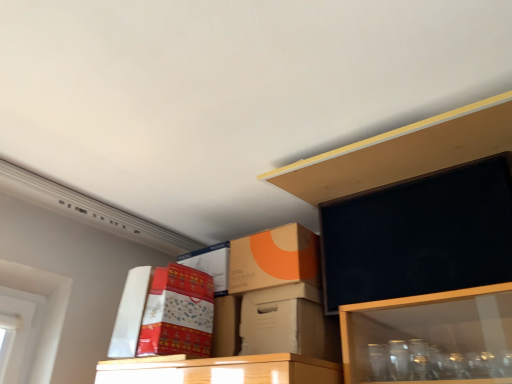
Question: Should I look upward or downward to see orange matte cardboard box at upper center, which is the second box in left-to-right order?

Choices:
 (A) up
 (B) down

Answer: (B)

Question: Is matte cardboard box at upper center in front of natural wood shelf at upper center?

Choices:
 (A) yes
 (B) no

Answer: (B)

Question: Does matte cardboard box at upper center have a lesser width compared to natural wood shelf at upper center?

Choices:
 (A) yes
 (B) no

Answer: (A)

Question: Can you confirm if matte cardboard box at upper center is bigger than natural wood shelf at upper center?

Choices:
 (A) no
 (B) yes

Answer: (A)

Question: Could you tell me if matte cardboard box at upper center is facing natural wood shelf at upper center?

Choices:
 (A) no
 (B) yes

Answer: (A)

Question: Can we say matte cardboard box at upper center lies outside natural wood shelf at upper center?

Choices:
 (A) no
 (B) yes

Answer: (B)

Question: Is matte cardboard box at upper center facing away from natural wood shelf at upper center?

Choices:
 (A) yes
 (B) no

Answer: (B)

Question: Is the position of white cardboard box at center, which is the 1th box from right to left, less distant than that of white cardboard box at upper left, placed as the 3th box when sorted from right to left?

Choices:
 (A) no
 (B) yes

Answer: (B)

Question: From the image's perspective, would you say white cardboard box at center, which is the 1th box from right to left, is shown under white cardboard box at upper left, placed as the 3th box when sorted from right to left?

Choices:
 (A) no
 (B) yes

Answer: (B)

Question: Is the position of white cardboard box at center, which is the 1th box from right to left, more distant than that of white cardboard box at upper left, which ranks as the 1th box in left-to-right order?

Choices:
 (A) yes
 (B) no

Answer: (B)

Question: Does white cardboard box at center, the third box from the left, have a lesser width compared to white cardboard box at upper left, placed as the 3th box when sorted from right to left?

Choices:
 (A) no
 (B) yes

Answer: (A)

Question: Is white cardboard box at center, which is the 1th box from right to left, positioned far away from white cardboard box at upper left, placed as the 3th box when sorted from right to left?

Choices:
 (A) no
 (B) yes

Answer: (A)

Question: Can we say white cardboard box at center, which is the 1th box from right to left, lies outside white cardboard box at upper left, which ranks as the 1th box in left-to-right order?

Choices:
 (A) yes
 (B) no

Answer: (A)

Question: Does orange matte cardboard box at upper center, positioned as the second box in right-to-left order, turn towards matte cardboard box at upper center?

Choices:
 (A) no
 (B) yes

Answer: (A)